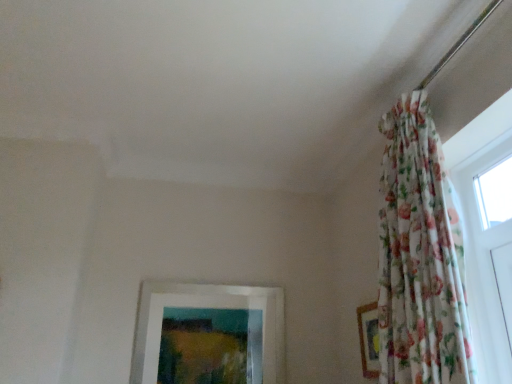
Question: Which direction should I rotate to look at white matte picture frame at lower center, the 1th picture frame when ordered from left to right?

Choices:
 (A) left
 (B) right

Answer: (A)

Question: Is transparent glass window at upper right in front of floral fabric picture frame at right, placed as the 1th picture frame when sorted from front to back?

Choices:
 (A) no
 (B) yes

Answer: (B)

Question: Is the position of transparent glass window at upper right more distant than that of floral fabric picture frame at right, placed as the 1th picture frame when sorted from front to back?

Choices:
 (A) no
 (B) yes

Answer: (A)

Question: Is transparent glass window at upper right with floral fabric picture frame at right, positioned as the 1th picture frame in right-to-left order?

Choices:
 (A) yes
 (B) no

Answer: (B)

Question: From the image's perspective, is transparent glass window at upper right located above floral fabric picture frame at right, placed as the 1th picture frame when sorted from front to back?

Choices:
 (A) yes
 (B) no

Answer: (A)

Question: Is transparent glass window at upper right turned away from floral fabric picture frame at right, placed as the 1th picture frame when sorted from front to back?

Choices:
 (A) no
 (B) yes

Answer: (A)

Question: Considering the relative sizes of transparent glass window at upper right and floral fabric picture frame at right, positioned as the 1th picture frame in right-to-left order, in the image provided, is transparent glass window at upper right wider than floral fabric picture frame at right, positioned as the 1th picture frame in right-to-left order,?

Choices:
 (A) no
 (B) yes

Answer: (B)

Question: Is white matte picture frame at lower center, the 1th picture frame when ordered from back to front, closer to camera compared to floral fabric curtain at upper right?

Choices:
 (A) no
 (B) yes

Answer: (A)

Question: From the image's perspective, is white matte picture frame at lower center, acting as the 2th picture frame starting from the right, on floral fabric curtain at upper right?

Choices:
 (A) no
 (B) yes

Answer: (A)

Question: From the image's perspective, is white matte picture frame at lower center, the 2th picture frame when ordered from front to back, below floral fabric curtain at upper right?

Choices:
 (A) no
 (B) yes

Answer: (B)

Question: Are white matte picture frame at lower center, the 2th picture frame when ordered from front to back, and floral fabric curtain at upper right beside each other?

Choices:
 (A) no
 (B) yes

Answer: (A)

Question: Does white matte picture frame at lower center, the 1th picture frame when ordered from back to front, have a lesser height compared to floral fabric curtain at upper right?

Choices:
 (A) yes
 (B) no

Answer: (A)

Question: Does white matte picture frame at lower center, the 1th picture frame when ordered from back to front, have a larger size compared to floral fabric curtain at upper right?

Choices:
 (A) no
 (B) yes

Answer: (A)

Question: From a real-world perspective, is floral fabric picture frame at right, positioned as the 1th picture frame in right-to-left order, beneath white matte picture frame at lower center, the 1th picture frame when ordered from back to front?

Choices:
 (A) yes
 (B) no

Answer: (A)